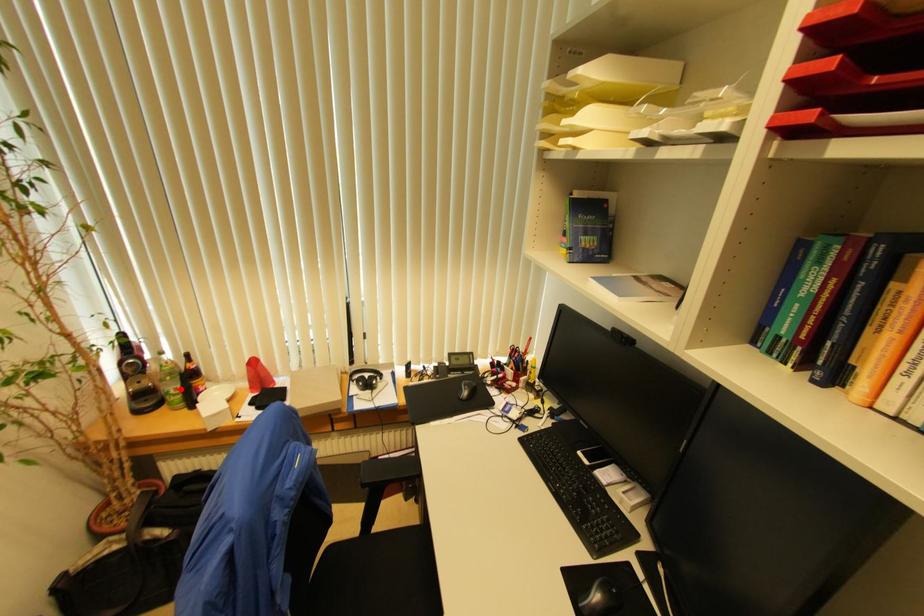
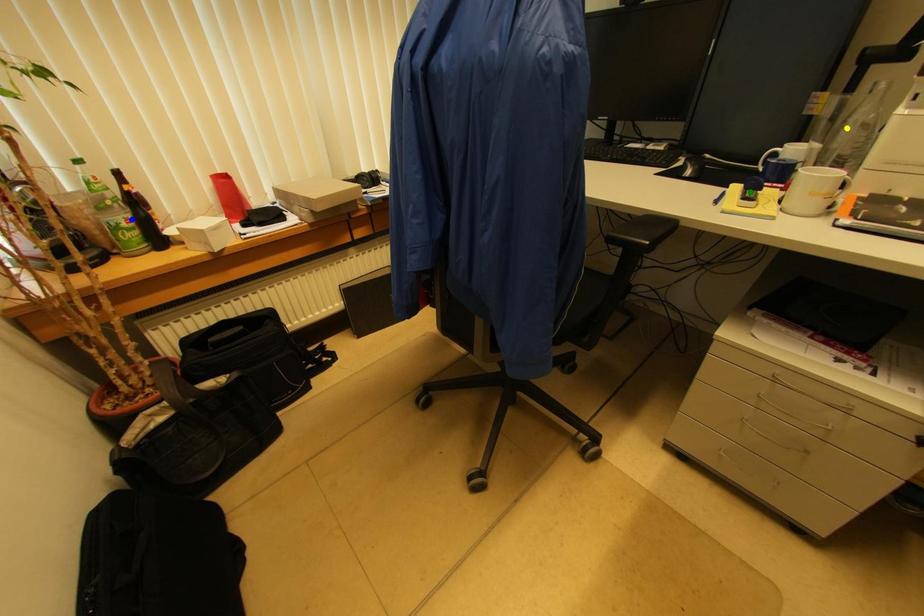
Question: I am providing you with two images of the same scene from different viewpoints. A red point is marked on the first image. You are given multiple points on the second image. Which mark in image 2 goes with the point in image 1?

Choices:
 (A) blue point
 (B) green point
 (C) yellow point

Answer: (A)